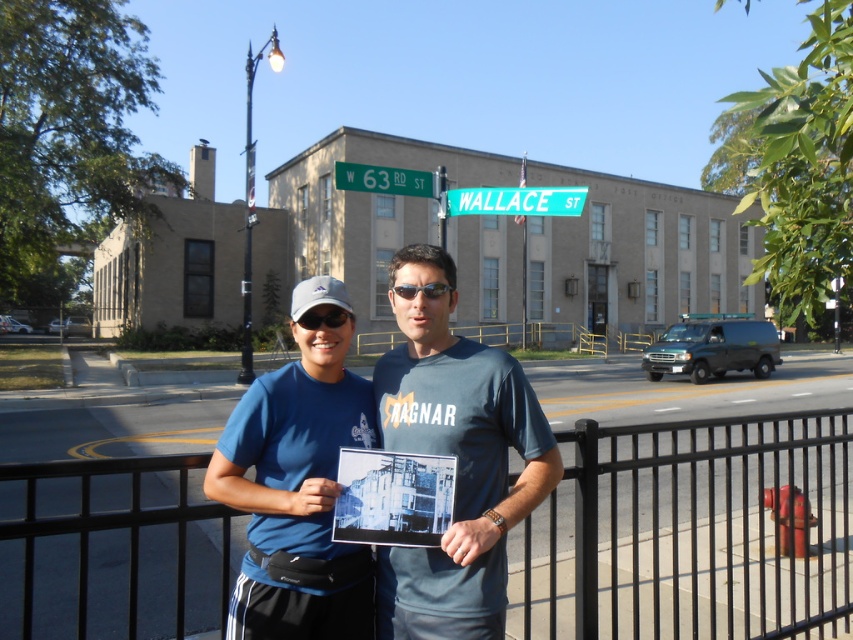
Can you confirm if green metallic street sign at upper center is bigger than sunglasses at center?

Yes, green metallic street sign at upper center is bigger than sunglasses at center.

Can you confirm if green metallic street sign at upper center is smaller than sunglasses at center?

Actually, green metallic street sign at upper center might be larger than sunglasses at center.

Locate an element on the screen. The height and width of the screenshot is (640, 853). green metallic street sign at upper center is located at coordinates (384, 179).

Is black plastic goggles at center shorter than sunglasses at center?

No.

Based on the photo, is black plastic goggles at center wider than sunglasses at center?

No.

Is point (309, 321) more distant than point (436, 296)?

No.

The width and height of the screenshot is (853, 640). Identify the location of black plastic goggles at center. (323, 317).

Is point (410, 192) behind point (328, 312)?

Yes, point (410, 192) is behind point (328, 312).

Between point (396, 186) and point (347, 314), which one is positioned behind?

The point (396, 186) is more distant.

At what (x,y) coordinates should I click in order to perform the action: click on green metallic street sign at upper center. Please return your answer as a coordinate pair (x, y). The height and width of the screenshot is (640, 853). Looking at the image, I should click on (384, 179).